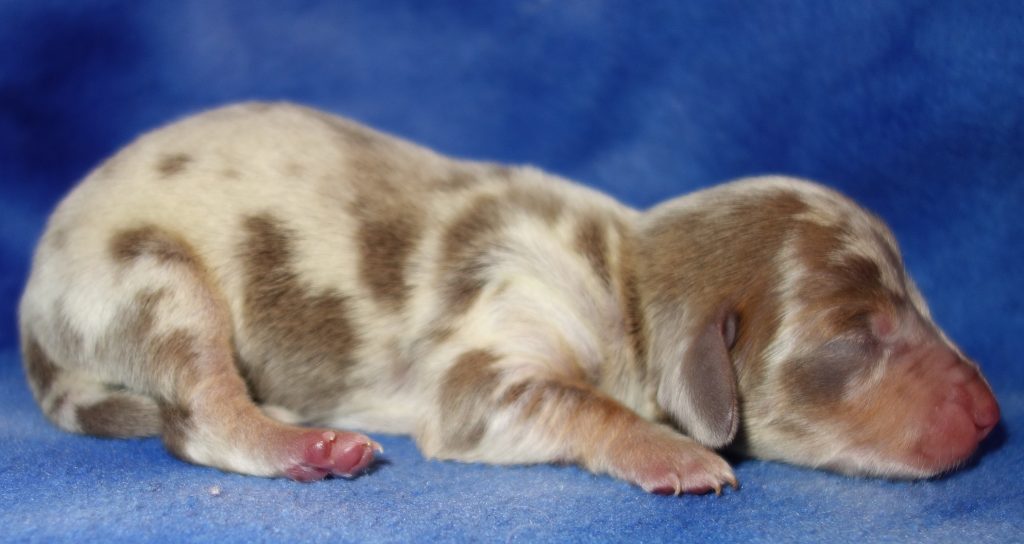
At what (x,y) coordinates should I click in order to perform the action: click on blanket. Please return your answer as a coordinate pair (x, y). This screenshot has width=1024, height=544. Looking at the image, I should click on (499, 493).